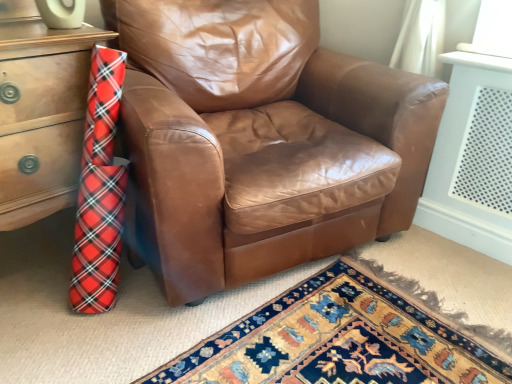
Question: Does wooden chest of drawers at left have a larger size compared to brown leather chair at center?

Choices:
 (A) no
 (B) yes

Answer: (A)

Question: Is wooden chest of drawers at left at the right side of brown leather chair at center?

Choices:
 (A) yes
 (B) no

Answer: (B)

Question: Is wooden chest of drawers at left in front of brown leather chair at center?

Choices:
 (A) yes
 (B) no

Answer: (B)

Question: From the image's perspective, is wooden chest of drawers at left on top of brown leather chair at center?

Choices:
 (A) no
 (B) yes

Answer: (A)

Question: Considering the relative positions of wooden chest of drawers at left and brown leather chair at center in the image provided, is wooden chest of drawers at left to the left of brown leather chair at center from the viewer's perspective?

Choices:
 (A) no
 (B) yes

Answer: (B)

Question: Is wooden chest of drawers at left taller than brown leather chair at center?

Choices:
 (A) no
 (B) yes

Answer: (A)

Question: Are brown leather chair at center and wooden chest of drawers at left beside each other?

Choices:
 (A) yes
 (B) no

Answer: (B)

Question: Is brown leather chair at center wider than wooden chest of drawers at left?

Choices:
 (A) no
 (B) yes

Answer: (B)

Question: Does brown leather chair at center have a greater height compared to wooden chest of drawers at left?

Choices:
 (A) yes
 (B) no

Answer: (A)

Question: Is brown leather chair at center thinner than wooden chest of drawers at left?

Choices:
 (A) no
 (B) yes

Answer: (A)

Question: Is brown leather chair at center to the right of wooden chest of drawers at left from the viewer's perspective?

Choices:
 (A) yes
 (B) no

Answer: (A)

Question: Can wooden chest of drawers at left be found inside brown leather chair at center?

Choices:
 (A) yes
 (B) no

Answer: (B)

Question: Is wooden chest of drawers at left taller or shorter than brown leather chair at center?

Choices:
 (A) short
 (B) tall

Answer: (A)